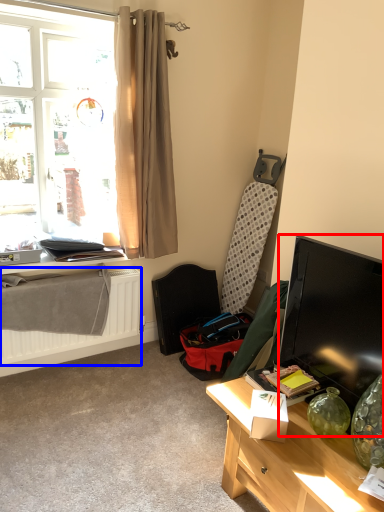
Question: Which object is further to the camera taking this photo, television (highlighted by a red box) or radiator (highlighted by a blue box)?

Choices:
 (A) television
 (B) radiator

Answer: (B)